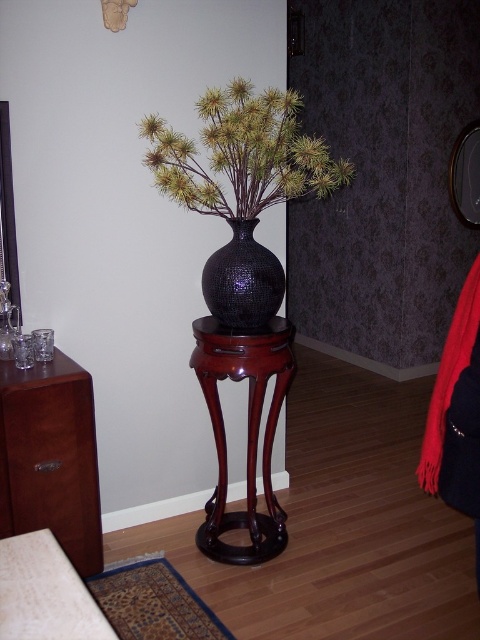
Question: Which object is farther from the camera taking this photo?

Choices:
 (A) green matte vase at center
 (B) black textured vase at center

Answer: (B)

Question: Is green matte vase at center in front of black textured vase at center?

Choices:
 (A) yes
 (B) no

Answer: (A)

Question: Is green matte vase at center wider than black textured vase at center?

Choices:
 (A) no
 (B) yes

Answer: (B)

Question: Is green matte vase at center to the right of mahogany wood dresser at left from the viewer's perspective?

Choices:
 (A) yes
 (B) no

Answer: (A)

Question: Which object is closer to the camera taking this photo?

Choices:
 (A) green matte vase at center
 (B) mahogany wood side table at center

Answer: (A)

Question: Which point appears farthest from the camera in this image?

Choices:
 (A) (91, 536)
 (B) (34, 560)
 (C) (344, 173)
 (D) (206, 328)

Answer: (D)